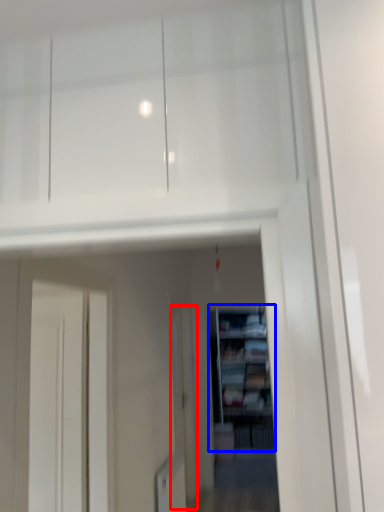
Question: Which object appears closest to the camera in this image, screen door (highlighted by a red box) or shelf (highlighted by a blue box)?

Choices:
 (A) screen door
 (B) shelf

Answer: (A)